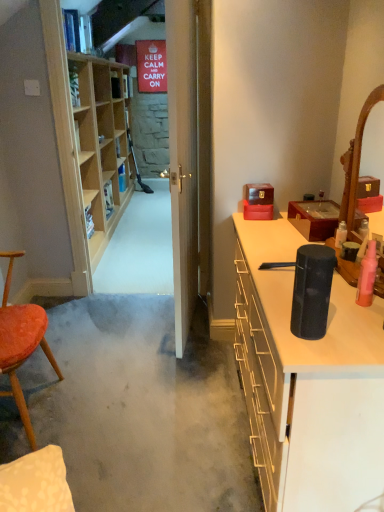
What are the coordinates of `vacant area that is in front of white wooden door at center` in the screenshot? It's located at (171, 370).